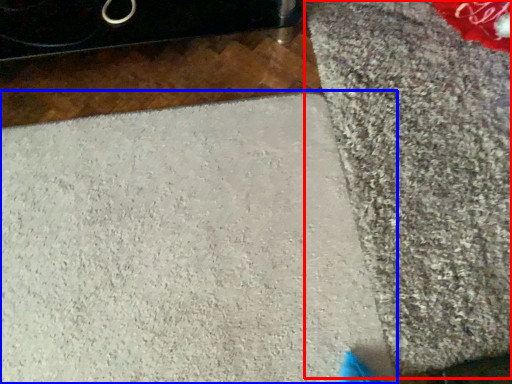
Question: Among these objects, which one is nearest to the camera, mat (highlighted by a red box) or concrete (highlighted by a blue box)?

Choices:
 (A) mat
 (B) concrete

Answer: (B)